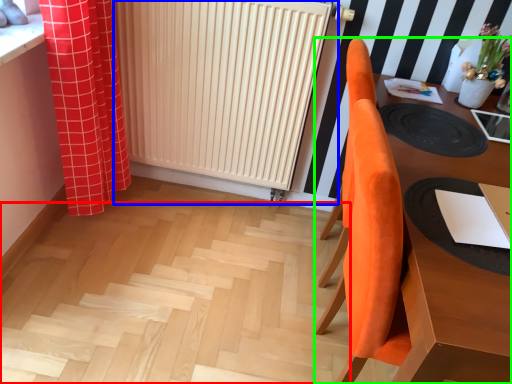
Question: Based on their relative distances, which object is nearer to stairs (highlighted by a red box)? Choose from radiator (highlighted by a blue box) and furniture (highlighted by a green box).

Choices:
 (A) radiator
 (B) furniture

Answer: (A)